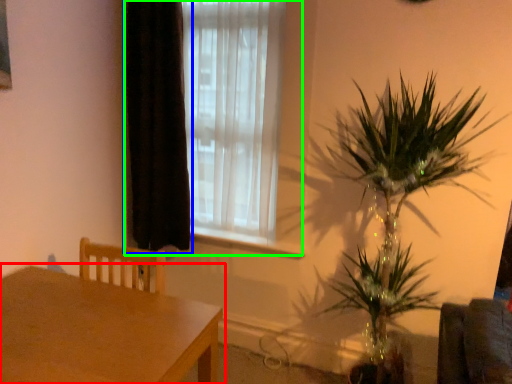
Question: Which object is the farthest from table (highlighted by a red box)? Choose among these: curtain (highlighted by a blue box) or window (highlighted by a green box).

Choices:
 (A) curtain
 (B) window

Answer: (B)